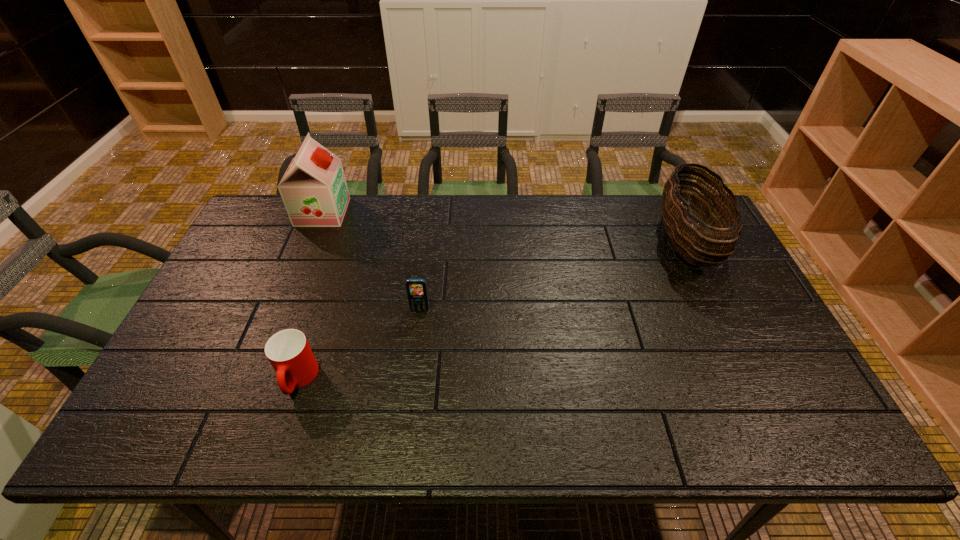
Locate an element on the screen. This screenshot has width=960, height=540. free space at the near left corner of the desktop is located at coordinates (209, 413).

Find the location of a particular element. This screenshot has height=540, width=960. free space between the tallest object and the rightmost object is located at coordinates (504, 227).

Where is `vacant space in between the cellular telephone and the tallest object`? vacant space in between the cellular telephone and the tallest object is located at coordinates (372, 261).

This screenshot has width=960, height=540. I want to click on vacant area that lies between the tallest object and the cellular telephone, so click(372, 261).

Where is `empty location between the third farthest object and the cup`? The height and width of the screenshot is (540, 960). empty location between the third farthest object and the cup is located at coordinates click(x=359, y=345).

Find the location of a particular element. Image resolution: width=960 pixels, height=540 pixels. free spot between the soya milk and the second tallest object is located at coordinates (504, 227).

Find the location of a particular element. The image size is (960, 540). vacant region between the soya milk and the rightmost object is located at coordinates tap(504, 227).

At what (x,y) coordinates should I click in order to perform the action: click on free space between the second tallest object and the soya milk. Please return your answer as a coordinate pair (x, y). Looking at the image, I should click on (504, 227).

Find the location of a particular element. Image resolution: width=960 pixels, height=540 pixels. free space that is in between the rightmost object and the soya milk is located at coordinates (504, 227).

Identify the location of vacant space in between the cellular telephone and the cup. This screenshot has height=540, width=960. (359, 345).